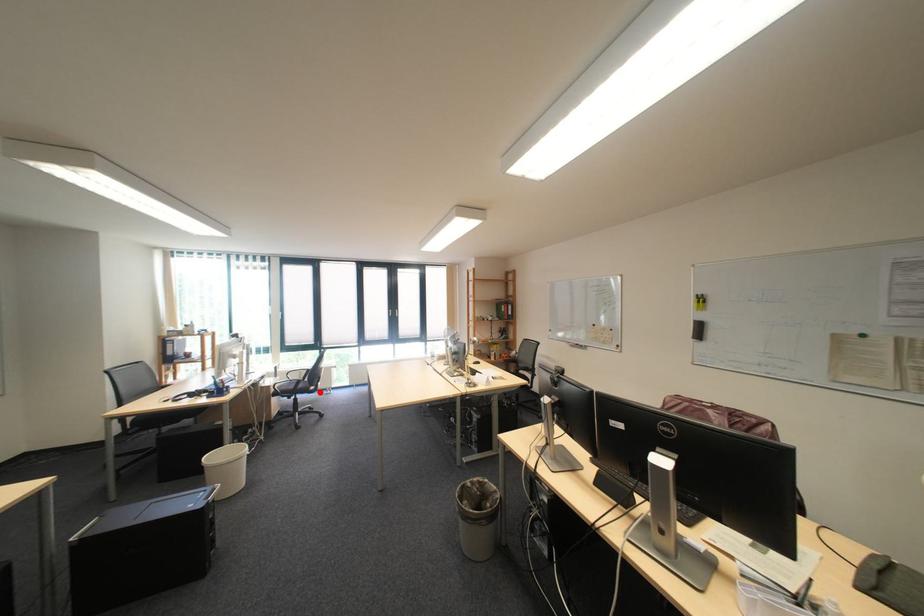
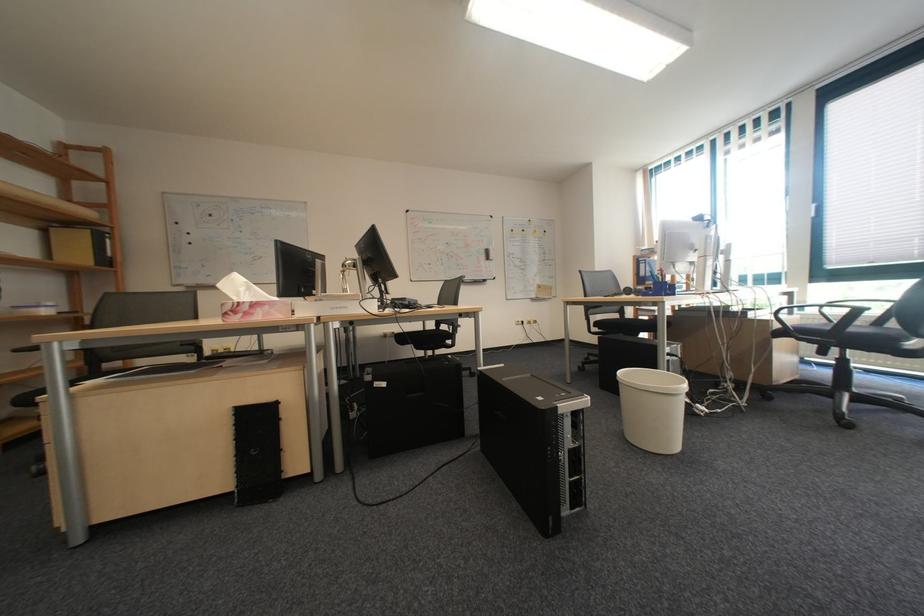
Where in the second image is the point corresponding to the highlighted location from the first image?

(896, 346)